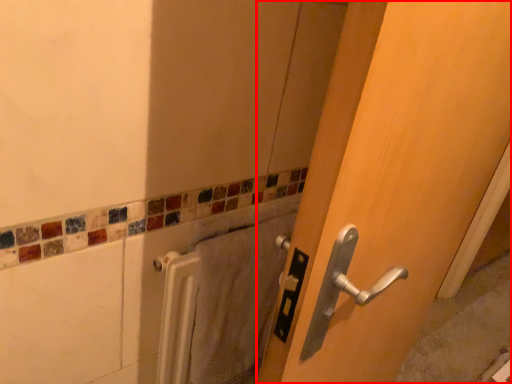
Question: In this image, where is door (annotated by the red box) located relative to bath towel?

Choices:
 (A) right
 (B) left

Answer: (A)